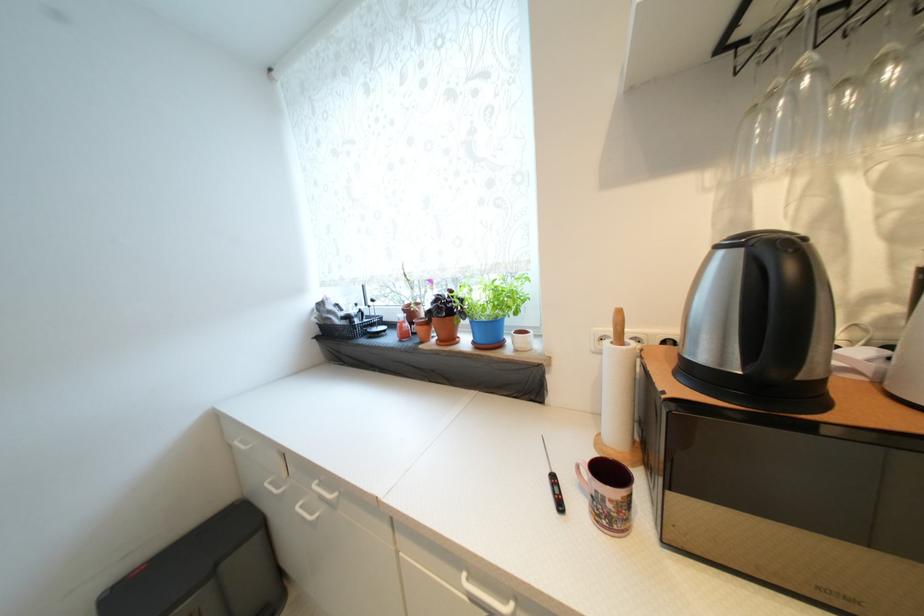
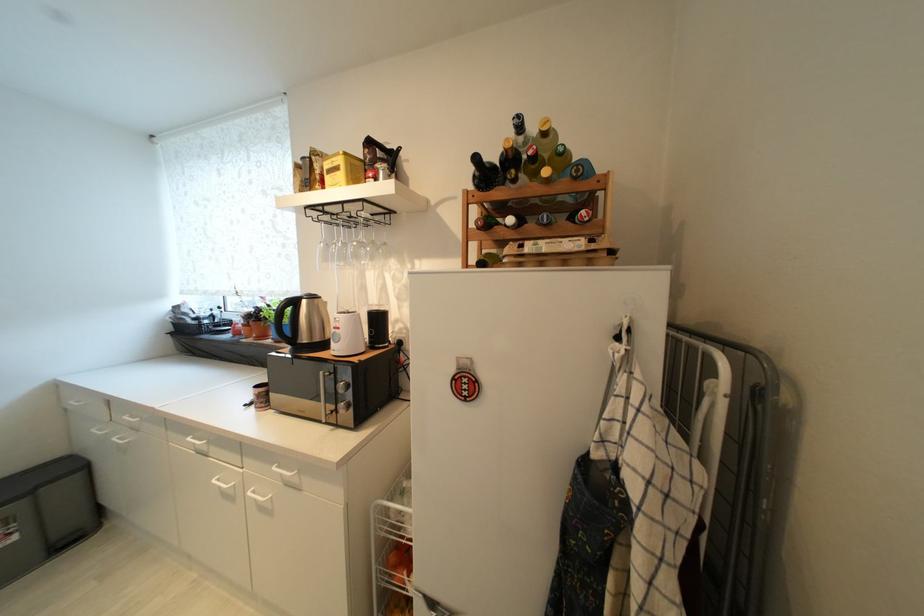
Which direction would the cameraman need to move to produce the second image?

The cameraman walked toward right, backward.